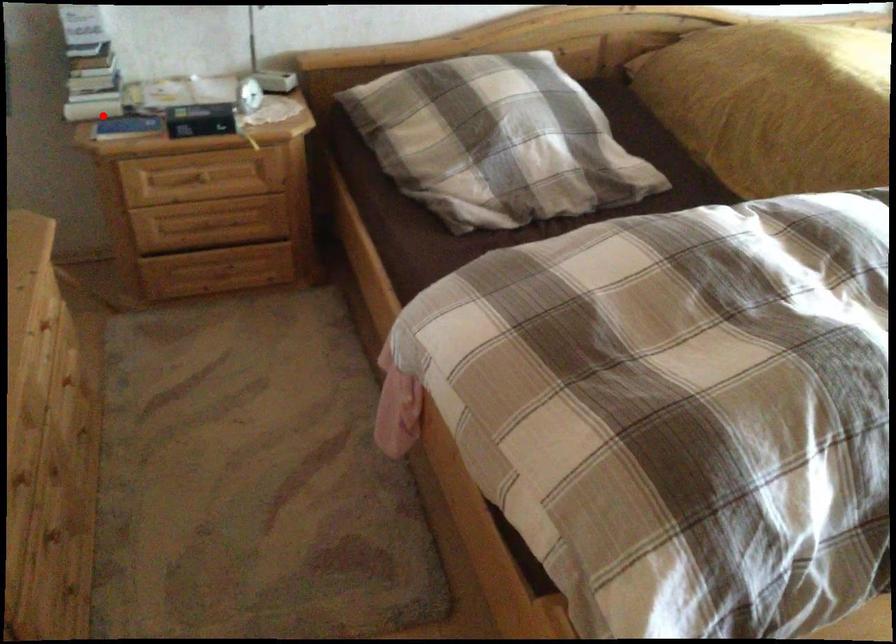
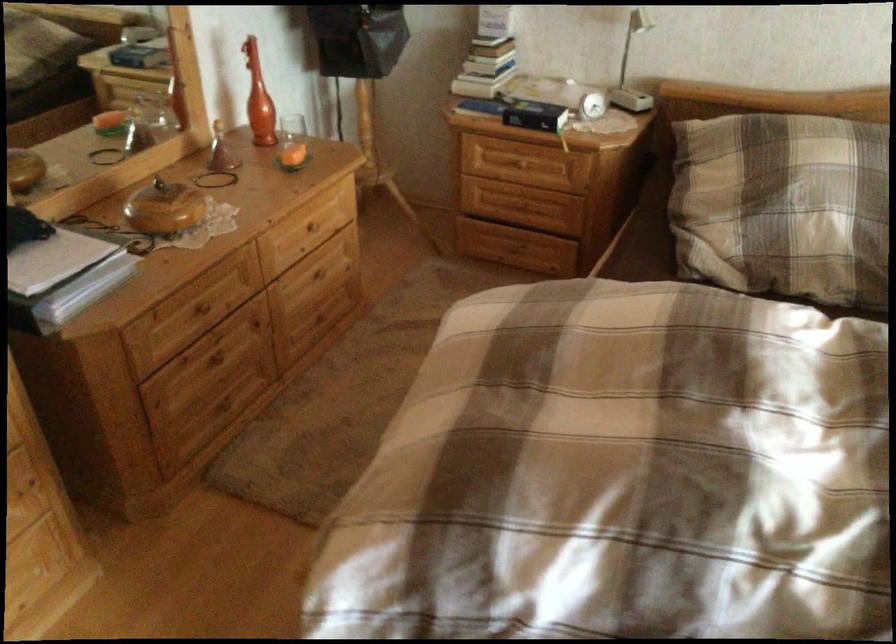
Question: I am providing you with two images of the same scene from different viewpoints. Given a red point in image1, look at the same physical point in image2. Is it:

Choices:
 (A) Closer to the viewpoint
 (B) Farther from the viewpoint

Answer: (B)